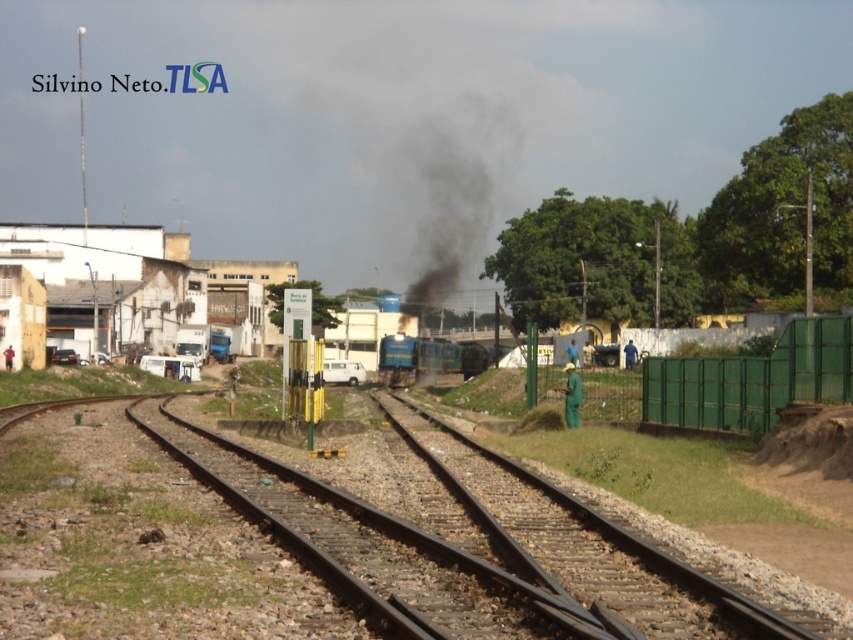
Is brown gravel train track at center positioned at the back of blue metallic train at center?

No, it is not.

Does point (703, 595) lie in front of point (383, 339)?

Yes, it is in front of point (383, 339).

Identify the location of brown gravel train track at center. The image size is (853, 640). (627, 538).

Looking at this image, can you confirm if metal train tracks at center is wider than brown gravel train track at center?

Indeed, metal train tracks at center has a greater width compared to brown gravel train track at center.

Is point (332, 486) positioned after point (397, 424)?

That is False.

Locate an element on the screen. The height and width of the screenshot is (640, 853). metal train tracks at center is located at coordinates (366, 545).

Locate an element on the screen. The image size is (853, 640). metal train tracks at center is located at coordinates (366, 545).

Is metal train tracks at center to the left of blue metallic train at center from the viewer's perspective?

Correct, you'll find metal train tracks at center to the left of blue metallic train at center.

Is metal train tracks at center positioned behind blue metallic train at center?

No, metal train tracks at center is in front of blue metallic train at center.

Find the location of a particular element. This screenshot has height=640, width=853. metal train tracks at center is located at coordinates (366, 545).